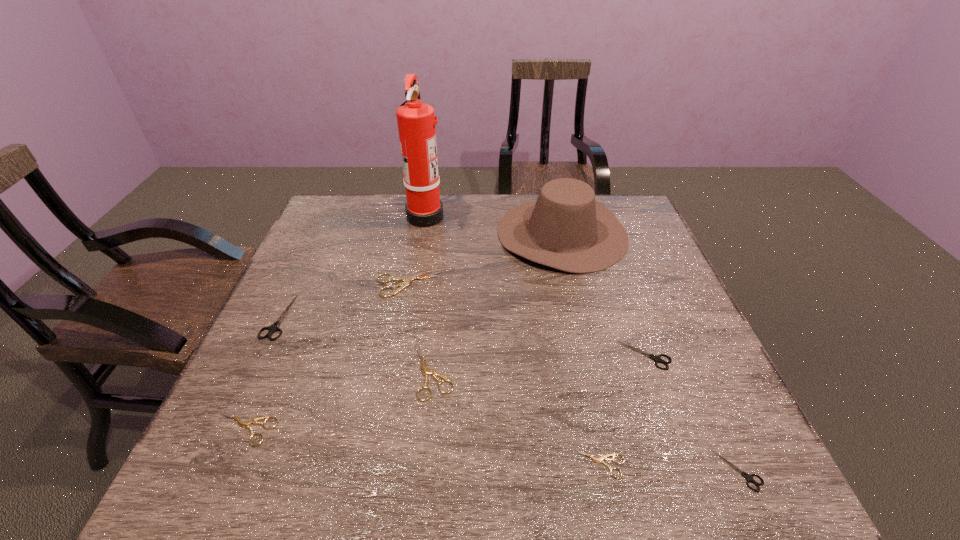
Find the location of a particular element. This screenshot has width=960, height=540. black shears identified as the closest to the biggest beige shears is located at coordinates (274, 327).

This screenshot has height=540, width=960. Identify the location of beige shears that is the nearest to the brown cowboy hat. (407, 280).

Where is `beige shears that is the second nearest to the second farthest beige shears`? This screenshot has width=960, height=540. beige shears that is the second nearest to the second farthest beige shears is located at coordinates (244, 424).

This screenshot has width=960, height=540. Identify the location of blank area in the image that satisfies the following two spatial constraints: 1. on the back side of the leftmost black shears; 2. on the left side of the biggest beige shears. (294, 285).

The width and height of the screenshot is (960, 540). I want to click on free spot that satisfies the following two spatial constraints: 1. at the nozzle of the shortest shears; 2. on the right side of the red fire extinguisher, so click(383, 464).

Locate an element on the screen. This screenshot has width=960, height=540. free spot that satisfies the following two spatial constraints: 1. on the back side of the rightmost beige shears; 2. on the right side of the second tallest object is located at coordinates (552, 233).

I want to click on vacant area in the image that satisfies the following two spatial constraints: 1. on the front side of the biggest beige shears; 2. on the right side of the third smallest beige shears, so click(394, 372).

Identify the location of free region that satisfies the following two spatial constraints: 1. on the back side of the third smallest beige shears; 2. at the nozzle of the red fire extinguisher. (448, 215).

The height and width of the screenshot is (540, 960). I want to click on blank space that satisfies the following two spatial constraints: 1. on the front side of the biggest black shears; 2. on the left side of the rightmost beige shears, so click(208, 464).